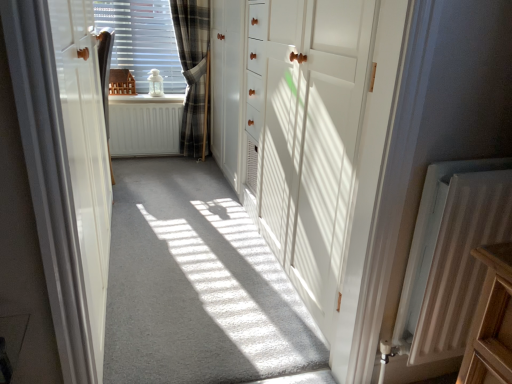
You are a GUI agent. You are given a task and a screenshot of the screen. Output one action in this format:
    pyautogui.click(x=<x>, y=<y>)
    Task: Click on the free location to the right of satin brown curtain at center, positioned as the 1th curtain in left-to-right order
    
    Given the screenshot: What is the action you would take?
    pyautogui.click(x=149, y=191)